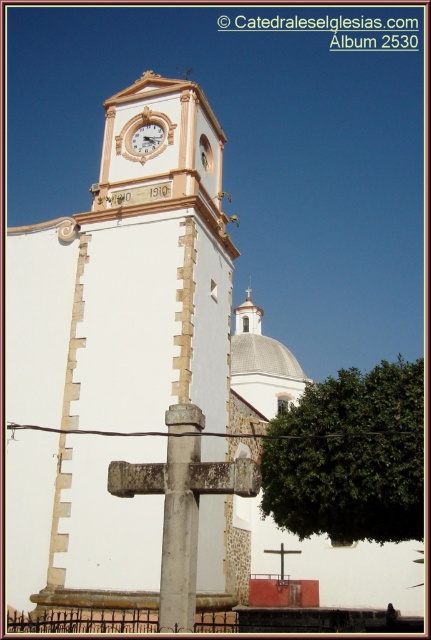
In the scene shown: You are a photographer planning to take a picture of the white wooden clock at upper center and the green leafy tree at center. Based on their sizes, which object should you focus on to ensure both are clearly visible in the frame?

The green leafy tree at center is larger than the white wooden clock at upper center, so focusing on the tree would ensure both objects are clearly visible in the frame.

You are an architect reviewing the design plans for a new clock tower. You notice two clocks labeled in the design blueprint. The first is the white painted wood clock at upper center, and the second is the white wooden clock at upper center. Which clock should be chosen for the main clock face based on their sizes?

The white painted wood clock at upper center should be chosen for the main clock face because it is larger in size than the white wooden clock at upper center.